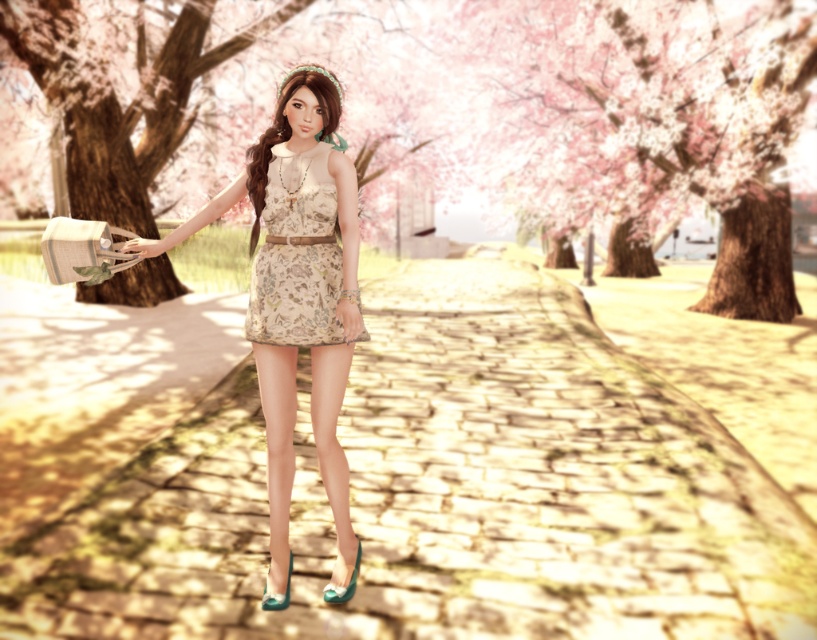
You are a photographer planning to capture a wide shot of the scene. The yellow stone pavement at center and the matte floral dress at center are both in the frame. Which object appears wider in the photo?

The yellow stone pavement at center appears wider than the matte floral dress at center because its width surpasses the dress.

You are standing at the point labeled point (x=117, y=99) in the image. What object is located at that point?

The point (x=117, y=99) corresponds to the brown textured tree at center.